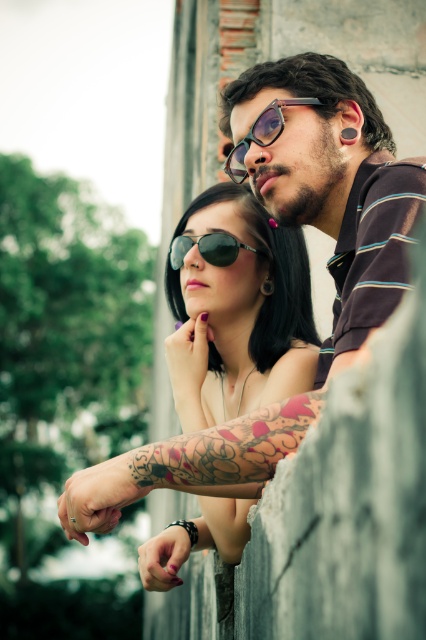
Question: Is matte black sunglasses at center to the right of black matte sunglasses at center from the viewer's perspective?

Choices:
 (A) yes
 (B) no

Answer: (A)

Question: Which of these objects is positioned farthest from the matte black sunglasses at center?

Choices:
 (A) matte black glasses at center
 (B) matte black sunglasses at upper center

Answer: (B)

Question: Among these points, which one is farthest from the camera?

Choices:
 (A) (340, 99)
 (B) (290, 99)
 (C) (178, 244)
 (D) (233, 257)

Answer: (C)

Question: Based on their relative distances, which object is nearer to the matte black sunglasses at upper center?

Choices:
 (A) matte black sunglasses at center
 (B) black matte sunglasses at center
 (C) matte black glasses at center

Answer: (C)

Question: Can you confirm if matte black sunglasses at upper center is positioned below black matte sunglasses at center?

Choices:
 (A) no
 (B) yes

Answer: (B)

Question: Can you confirm if matte black glasses at center is positioned to the right of black matte sunglasses at center?

Choices:
 (A) no
 (B) yes

Answer: (B)